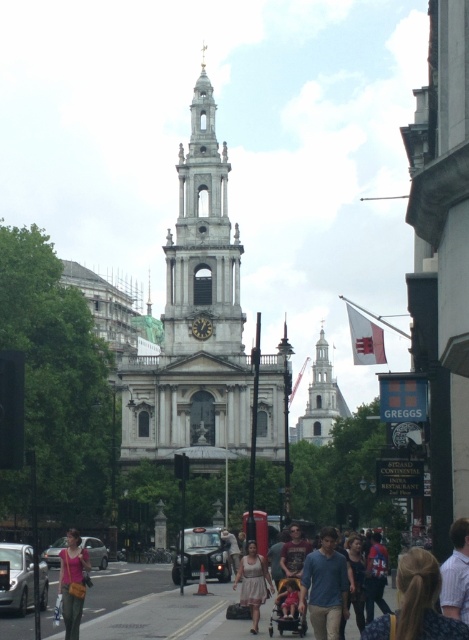
Question: Does dark gray plastic baby carriage at center appear on the right side of light brown leather jacket at center?

Choices:
 (A) yes
 (B) no

Answer: (A)

Question: Which of these objects is positioned farthest from the matte pink dress at center?

Choices:
 (A) blue denim jeans at center
 (B) striped shirt at center

Answer: (B)

Question: Is black matte taxi at center wider than silver metallic car at lower left?

Choices:
 (A) yes
 (B) no

Answer: (A)

Question: Based on their relative distances, which object is nearer to the blue denim jeans at center?

Choices:
 (A) matte pink dress at center
 (B) black matte taxi at center
 (C) silver metallic car at lower left
 (D) white stone clock tower at center

Answer: (A)

Question: Which object is farther from the camera taking this photo?

Choices:
 (A) blonde hair at center
 (B) striped shirt at center
 (C) blue cotton shirt at center

Answer: (C)

Question: From the image, what is the correct spatial relationship of striped shirt at center in relation to blue denim jeans at center?

Choices:
 (A) below
 (B) above

Answer: (B)